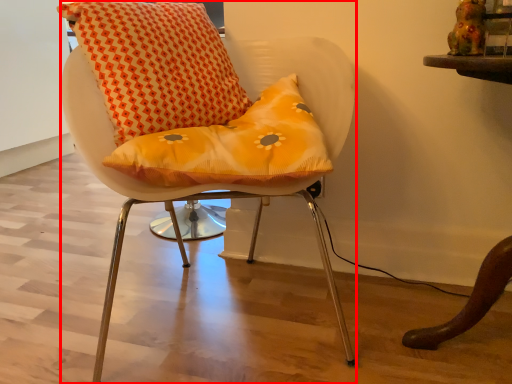
Question: Observing the image, what is the correct spatial positioning of chair (annotated by the red box) in reference to bean bag chair?

Choices:
 (A) left
 (B) right

Answer: (B)